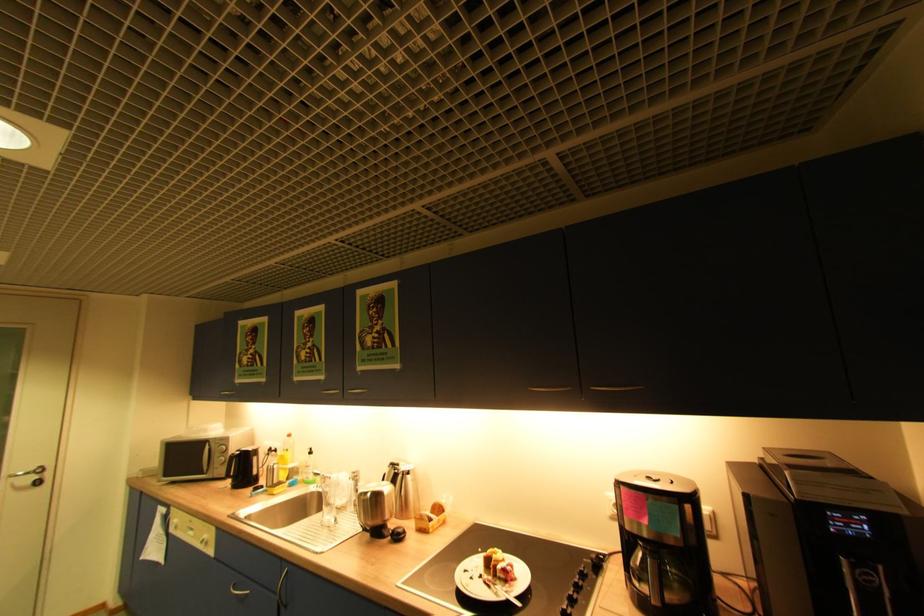
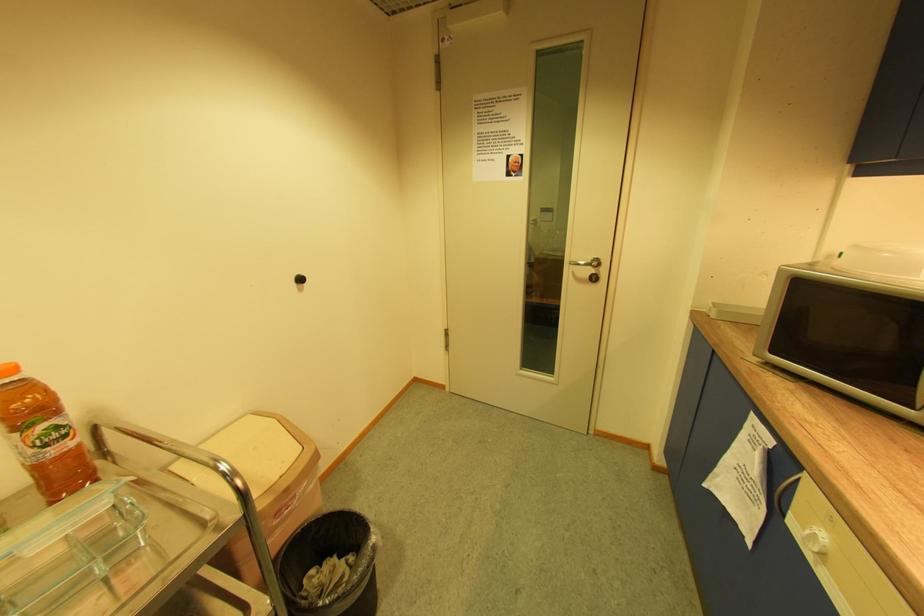
Locate, in the second image, the point that corresponds to pixel 41 477 in the first image.

(598, 272)